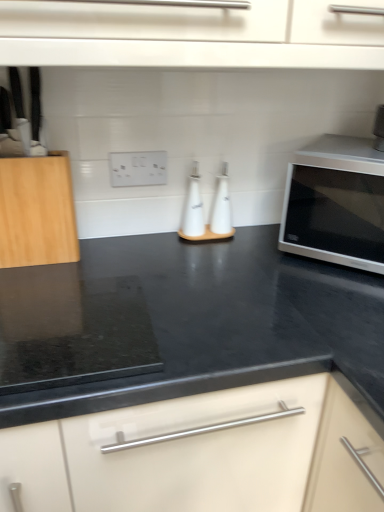
Find the location of a particular element. free location above satin silver microwave at right (from a real-world perspective) is located at coordinates (351, 150).